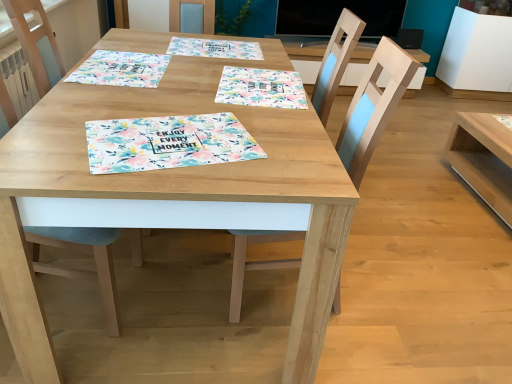
What are the coordinates of `free space that is in between floral paper placemat at upper center, marked as the second tablecloth in a right-to-left arrangement, and floral paper placemat at center` in the screenshot? It's located at (200, 88).